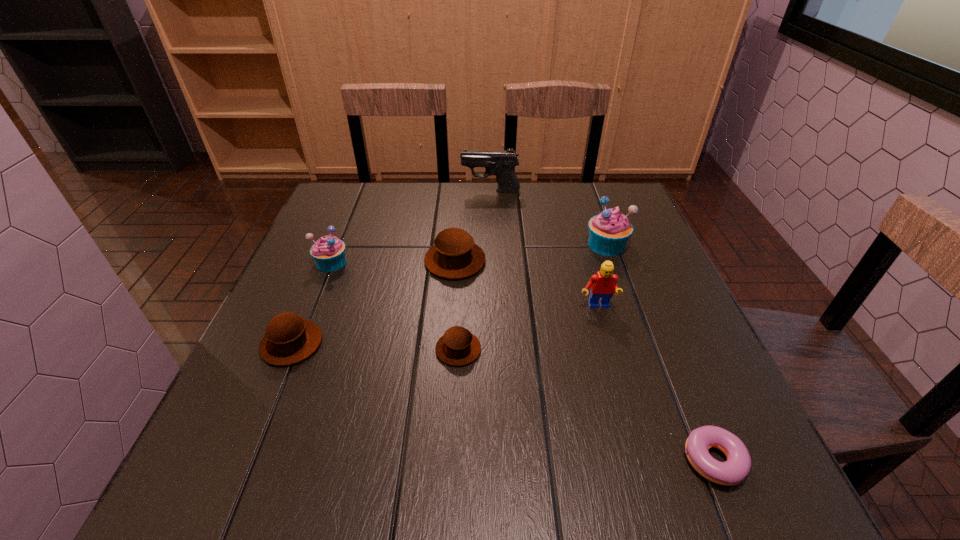
This screenshot has width=960, height=540. In the image, there is a desktop. In order to click on free space at the far edge in this screenshot , I will do `click(538, 198)`.

Locate an element on the screen. This screenshot has width=960, height=540. vacant space at the near edge is located at coordinates tap(633, 463).

This screenshot has width=960, height=540. Identify the location of vacant space at the left edge of the desktop. (343, 313).

I want to click on vacant space at the right edge of the desktop, so click(x=649, y=246).

Find the location of a particular element. vacant space at the near left corner is located at coordinates (179, 499).

This screenshot has height=540, width=960. Identify the location of free space at the far right corner. (596, 204).

Image resolution: width=960 pixels, height=540 pixels. In order to click on free space that is in between the fourth nearest object and the farthest brown muffin in this screenshot , I will do `click(526, 284)`.

Image resolution: width=960 pixels, height=540 pixels. What are the coordinates of `vacant space that's between the black pistol and the biggest brown muffin` in the screenshot? It's located at (473, 226).

The image size is (960, 540). I want to click on unoccupied area between the pistol and the second shortest muffin, so click(392, 267).

The image size is (960, 540). In order to click on free space between the second shortest muffin and the black pistol in this screenshot , I will do `click(392, 267)`.